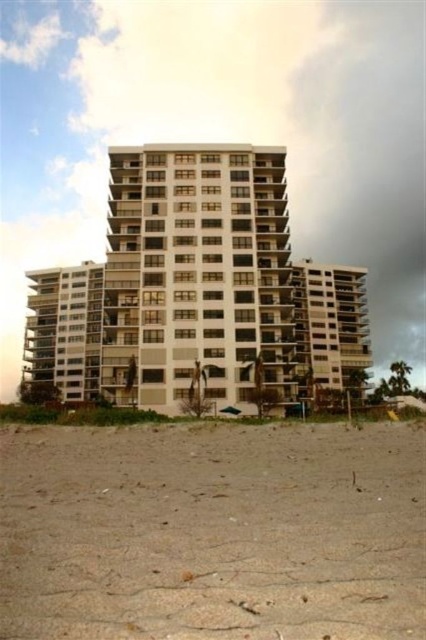
You are a photographer planning to capture the entire white smooth building at center and the brown sandy beach at lower center in one shot. Based on their sizes, which object should you focus on first to ensure both are visible in the frame?

The brown sandy beach at lower center has a smaller size compared to the white smooth building at center. To ensure both are visible, focus on the larger white smooth building at center first, then adjust the framing to include the smaller brown sandy beach at lower center.

Based on the photo, you are a visitor standing on the brown sandy beach at lower center and want to take a photo of the white smooth building at center. Which direction should you face to ensure the building is fully visible in your camera frame?

The brown sandy beach at lower center is not as tall as the white smooth building at center, so you should face upward to ensure the building is fully visible in your camera frame.